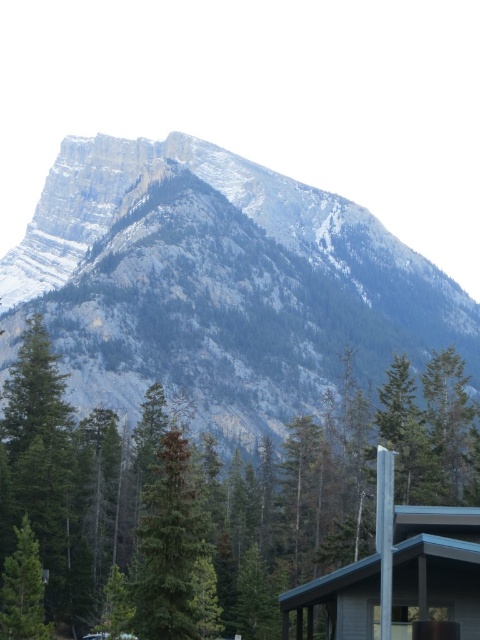
Consider the image. Does green matte tree at center have a smaller size compared to green matte evergreen tree at center?

Incorrect, green matte tree at center is not smaller in size than green matte evergreen tree at center.

Who is more distant from viewer, (365, 397) or (172, 557)?

The point (365, 397) is more distant.

Image resolution: width=480 pixels, height=640 pixels. Identify the location of green matte tree at center. click(x=332, y=484).

Does rocky gray mountain at upper center have a lesser height compared to green matte tree at center?

No.

Is rocky gray mountain at upper center smaller than green matte tree at center?

Incorrect, rocky gray mountain at upper center is not smaller in size than green matte tree at center.

Where is `rocky gray mountain at upper center`? The height and width of the screenshot is (640, 480). rocky gray mountain at upper center is located at coordinates (216, 284).

Locate an element on the screen. The height and width of the screenshot is (640, 480). rocky gray mountain at upper center is located at coordinates (216, 284).

The width and height of the screenshot is (480, 640). Describe the element at coordinates (216, 284) in the screenshot. I see `rocky gray mountain at upper center` at that location.

Does rocky gray mountain at upper center appear on the left side of wooden cabin at lower right?

Yes, rocky gray mountain at upper center is to the left of wooden cabin at lower right.

This screenshot has width=480, height=640. I want to click on rocky gray mountain at upper center, so click(216, 284).